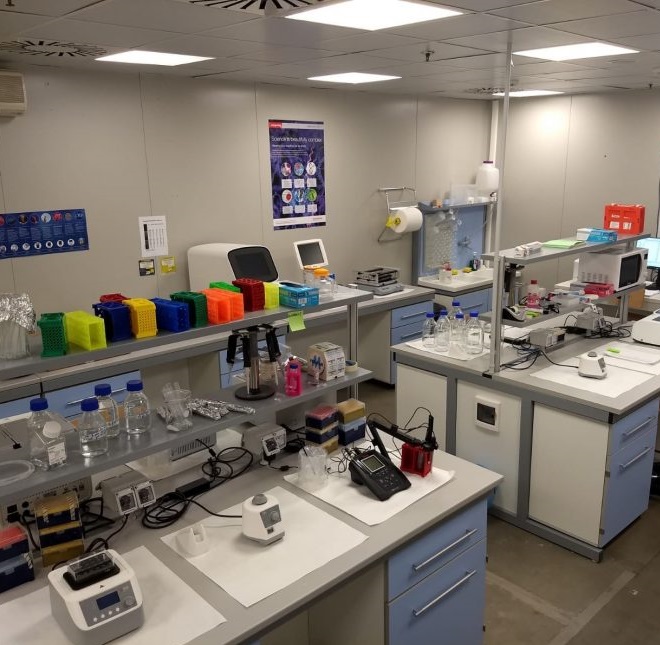
Where is `monitors`? monitors is located at coordinates (264, 273), (315, 258), (618, 275).